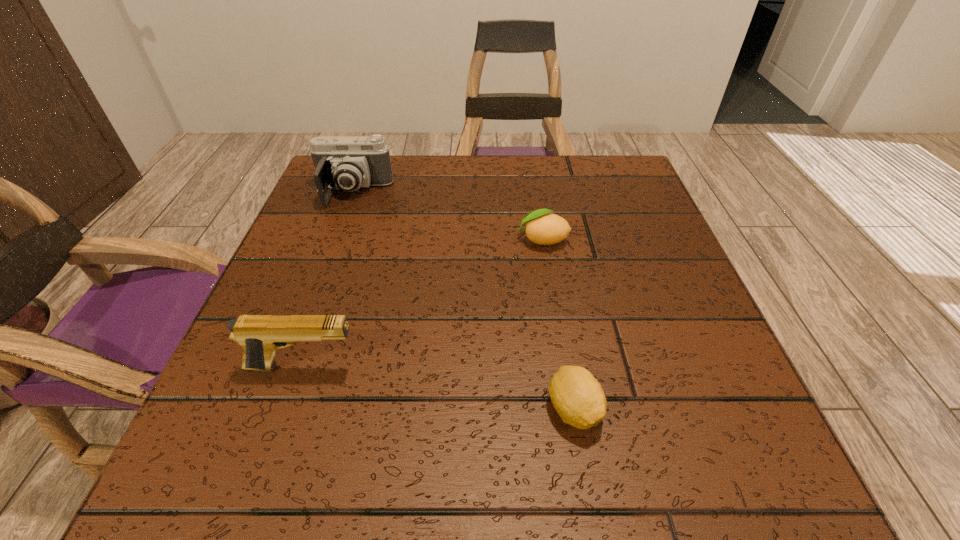
Locate which object is the third closest to the farther lemon. Please provide its 2D coordinates. Your answer should be formatted as a tuple, i.e. [(x, y)], where the tuple contains the x and y coordinates of a point satisfying the conditions above.

[(260, 335)]

Select which object appears as the second closest to the second nearest object. Please provide its 2D coordinates. Your answer should be formatted as a tuple, i.e. [(x, y)], where the tuple contains the x and y coordinates of a point satisfying the conditions above.

[(543, 228)]